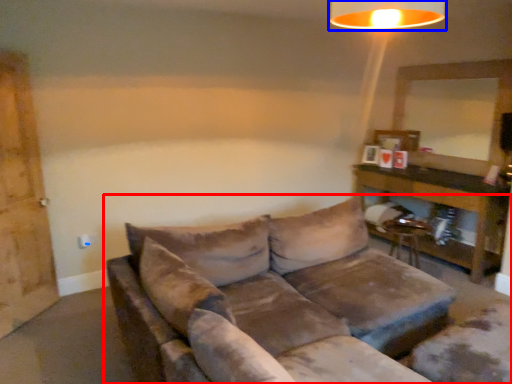
Question: Among these objects, which one is nearest to the camera, studio couch (highlighted by a red box) or lamp (highlighted by a blue box)?

Choices:
 (A) studio couch
 (B) lamp

Answer: (A)